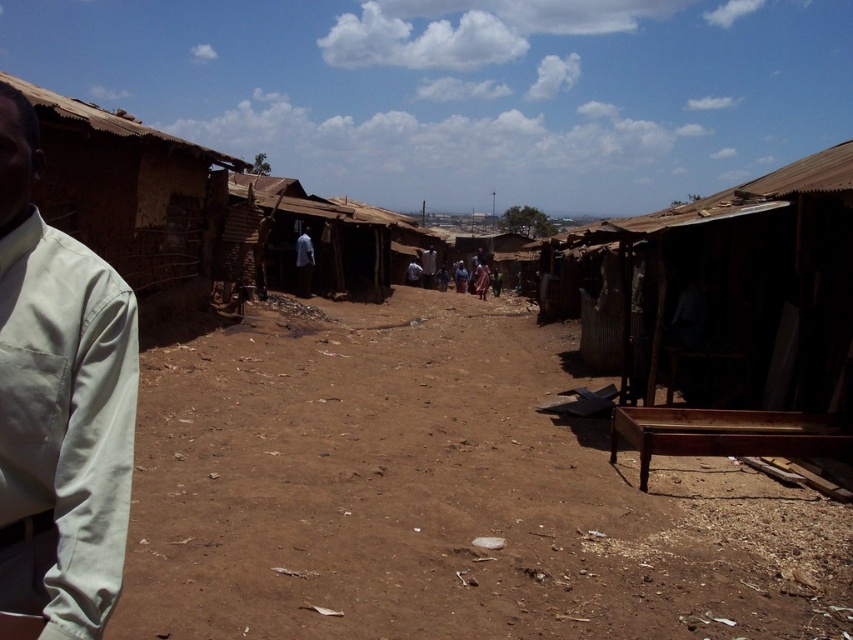
Between light gray fabric shirt at left and light brown wooden chair at center, which one appears on the right side from the viewer's perspective?

light brown wooden chair at center

Who is shorter, light gray fabric shirt at left or light brown wooden chair at center?

With less height is light gray fabric shirt at left.

Find the location of a particular element. light gray fabric shirt at left is located at coordinates (59, 404).

You are a GUI agent. You are given a task and a screenshot of the screen. Output one action in this format:
    pyautogui.click(x=<x>, y=<y>)
    Task: Click on the light gray fabric shirt at left
    
    Given the screenshot: What is the action you would take?
    pyautogui.click(x=59, y=404)

Is brown dirt field at center positioned in front of brown mud hut at left?

No, brown dirt field at center is further to the viewer.

Who is more distant from viewer, (194, 586) or (158, 284)?

The point (158, 284) is more distant.

Does point (734, 516) lie behind point (177, 280)?

No, (734, 516) is closer to viewer.

The width and height of the screenshot is (853, 640). I want to click on brown dirt field at center, so click(x=439, y=497).

Is brown dirt field at center below light brown wooden chair at center?

Correct, brown dirt field at center is located below light brown wooden chair at center.

The image size is (853, 640). Describe the element at coordinates (439, 497) in the screenshot. I see `brown dirt field at center` at that location.

The width and height of the screenshot is (853, 640). In order to click on brown dirt field at center in this screenshot , I will do `click(439, 497)`.